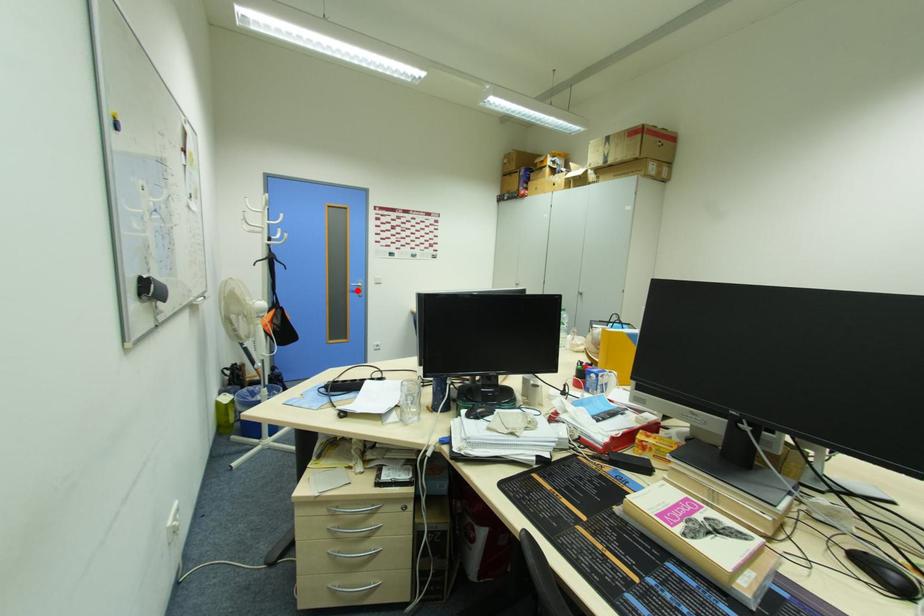
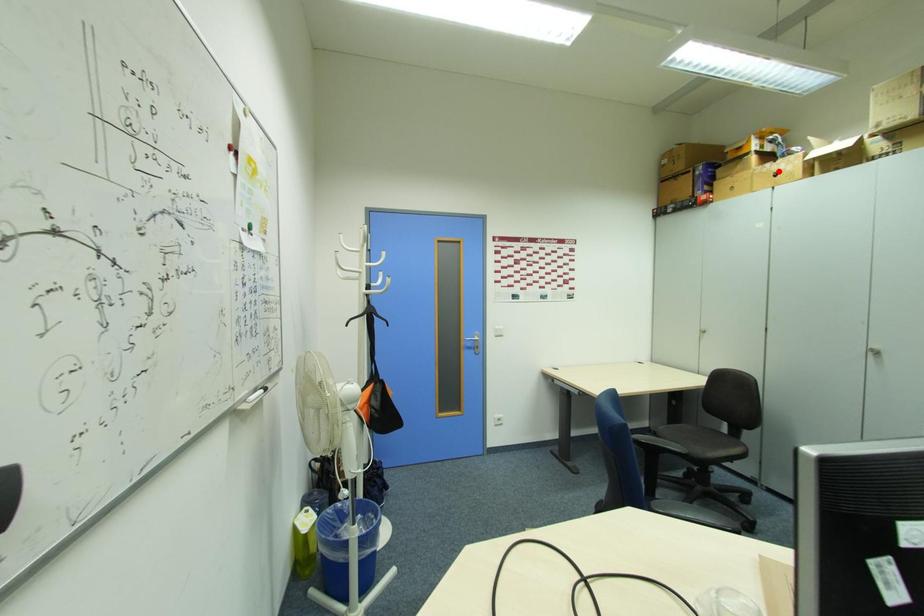
I am providing you with two images of the same scene from different viewpoints. A red point is marked on the first image and another point is marked on the second image. Do the highlighted points in image1 and image2 indicate the same real-world spot?

No